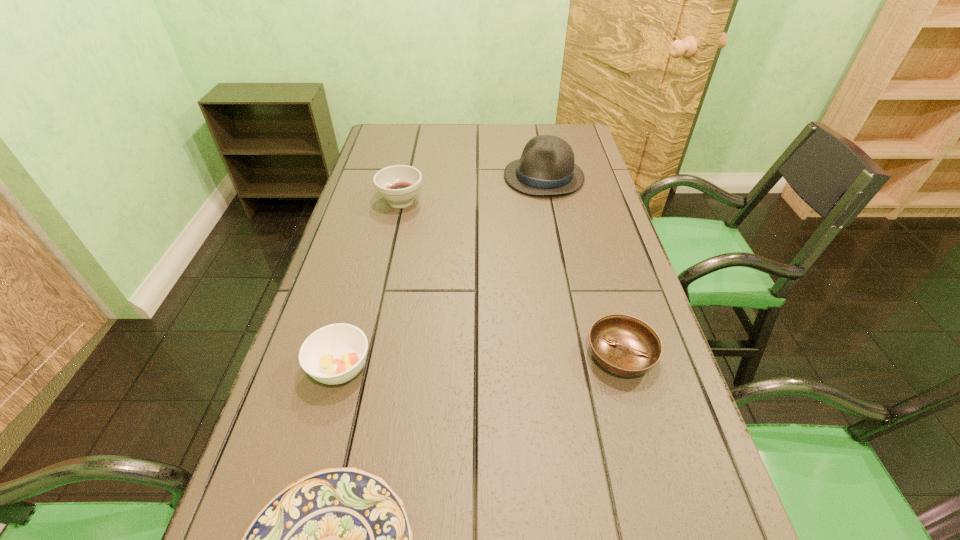
This screenshot has width=960, height=540. Find the location of `vacant space that is in between the farthest soup bowl and the tallest object`. vacant space that is in between the farthest soup bowl and the tallest object is located at coordinates (472, 189).

Locate an element on the screen. The width and height of the screenshot is (960, 540). vacant space that is in between the tallest object and the shortest soup bowl is located at coordinates (582, 266).

Identify the location of the closest object to the rightmost soup bowl. (339, 539).

Point out which object is positioned as the third nearest to the second shortest object. Please provide its 2D coordinates. Your answer should be formatted as a tuple, i.e. [(x, y)], where the tuple contains the x and y coordinates of a point satisfying the conditions above.

[(547, 166)]

The image size is (960, 540). In order to click on soup bowl that is the third nearest to the bowler hat in this screenshot , I will do click(x=334, y=354).

At what (x,y) coordinates should I click in order to perform the action: click on soup bowl that is the closest to the tallest object. Please return your answer as a coordinate pair (x, y). The width and height of the screenshot is (960, 540). Looking at the image, I should click on (399, 184).

Locate an element on the screen. This screenshot has width=960, height=540. vacant area that satisfies the following two spatial constraints: 1. on the back side of the tallest soup bowl; 2. on the right side of the second tallest soup bowl is located at coordinates (386, 201).

Identify the location of free space that satisfies the following two spatial constraints: 1. on the front-facing side of the bowler hat; 2. on the back side of the rightmost soup bowl. (579, 355).

Locate an element on the screen. This screenshot has height=540, width=960. vacant space that satisfies the following two spatial constraints: 1. on the back side of the shortest soup bowl; 2. on the front-facing side of the bowler hat is located at coordinates (570, 177).

What are the coordinates of `free space that satisfies the following two spatial constraints: 1. on the front-facing side of the tallest object; 2. on the front side of the farthest soup bowl` in the screenshot? It's located at (548, 201).